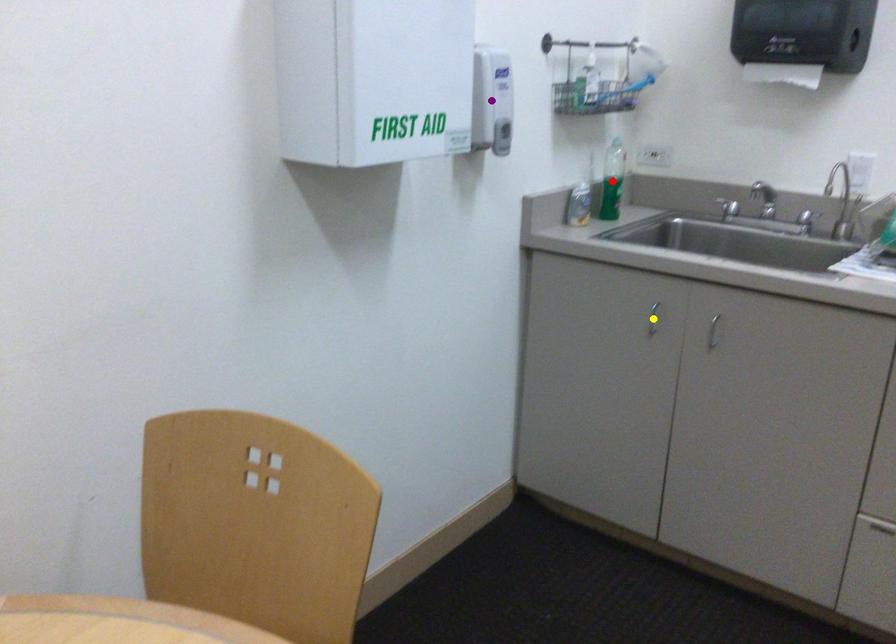
Order these from nearest to farthest:
A) yellow point
B) red point
C) purple point

red point → yellow point → purple point